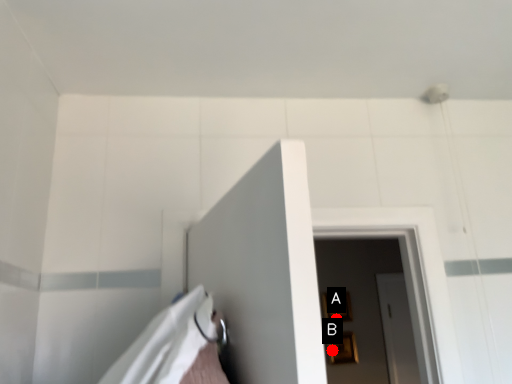
Question: Two points are circled on the image, labeled by A and B beside each circle. Among these points, which one is nearest to the camera?

Choices:
 (A) A is closer
 (B) B is closer

Answer: (B)